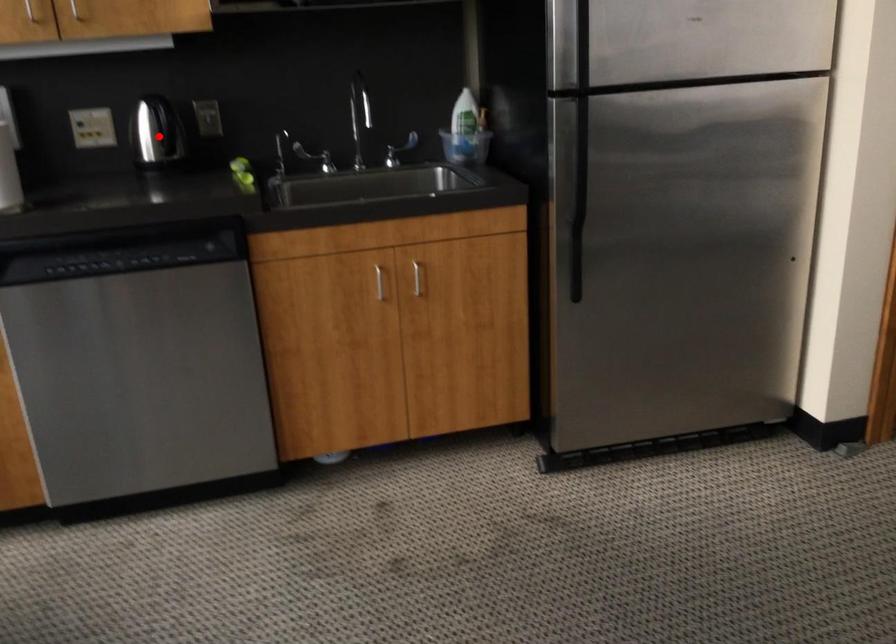
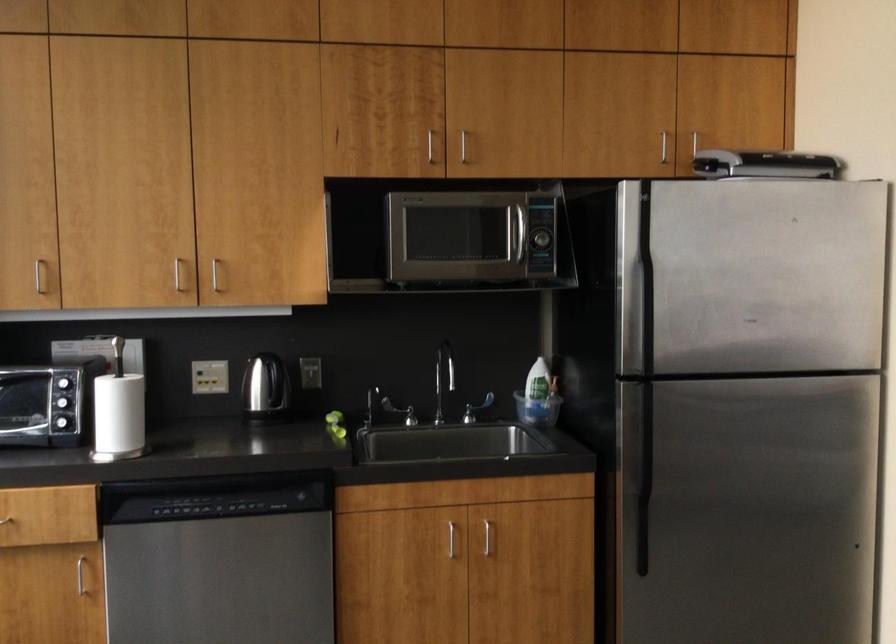
Question: I am providing you with two images of the same scene from different viewpoints. Given a red point in image1, look at the same physical point in image2. Is it:

Choices:
 (A) Closer to the viewpoint
 (B) Farther from the viewpoint

Answer: (B)